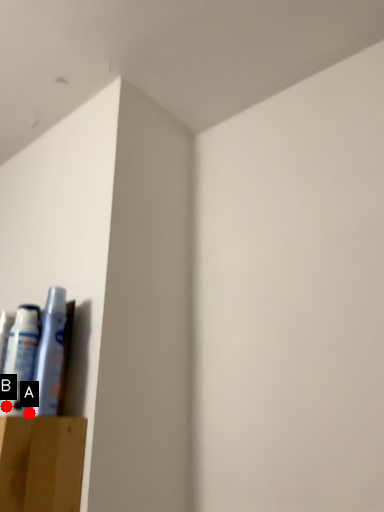
Question: Two points are circled on the image, labeled by A and B beside each circle. Which point appears closest to the camera in this image?

Choices:
 (A) A is closer
 (B) B is closer

Answer: (A)